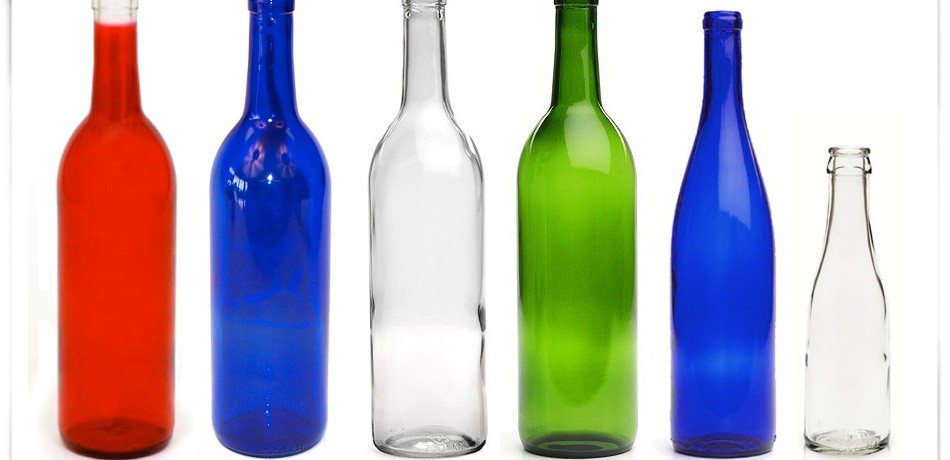
This screenshot has width=950, height=460. I want to click on glass bottle rims, so click(125, 4), click(264, 5), click(429, 3), click(574, 4), click(727, 14), click(840, 150).